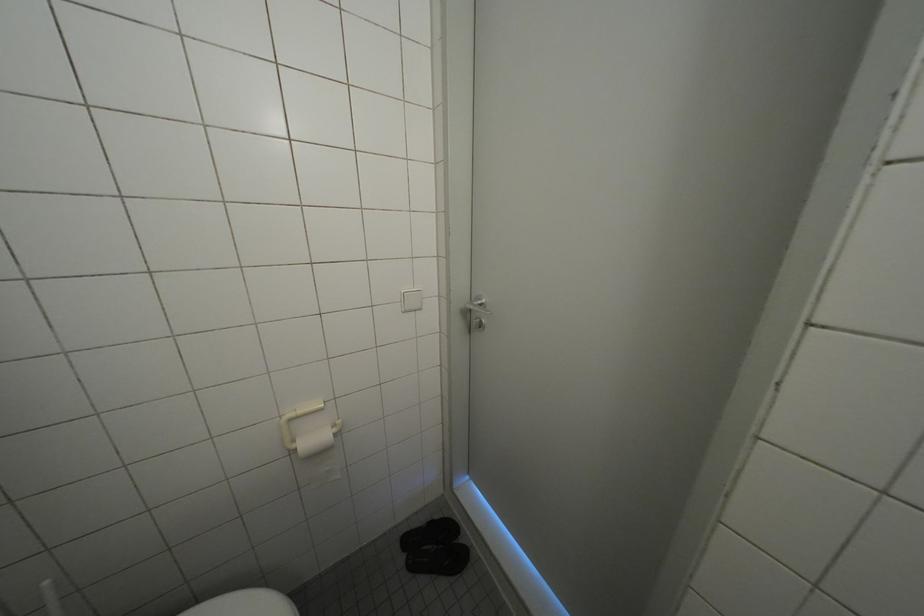
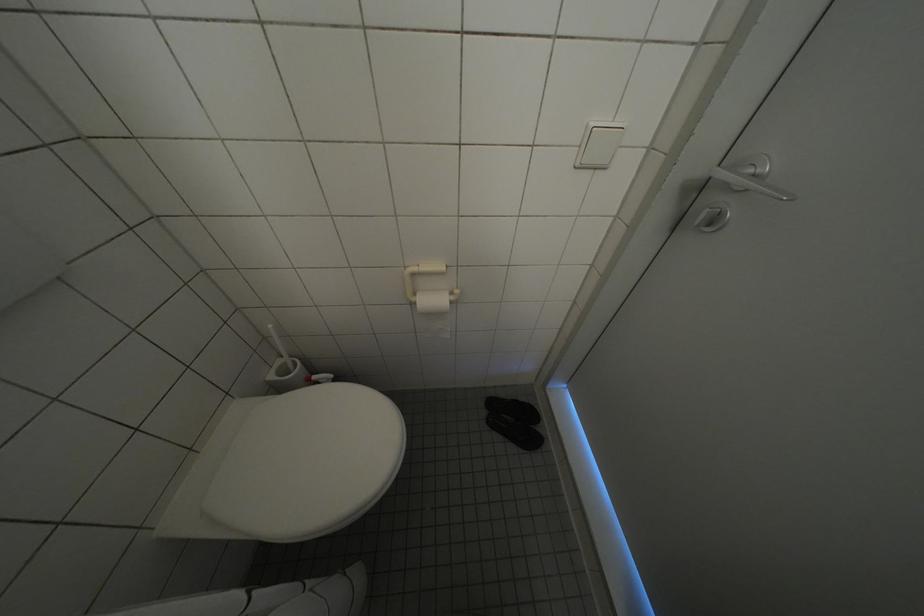
How did the camera likely rotate?

The camera rotated toward left-down.